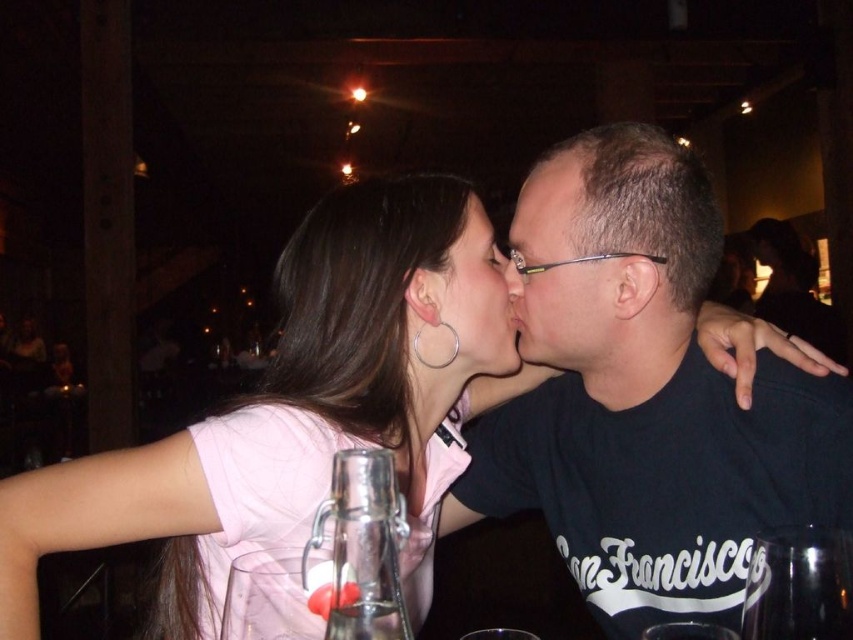
You are a photographer at the event and need to capture a clear photo of both the black matte shirt at center and the transparent glass at center. Since the transparent glass might be hard to focus on, can you adjust your camera settings to ensure both objects are in focus? Please explain using their sizes.

The black matte shirt at center is bigger than the transparent glass at center. By using a smaller aperture setting, you can increase the depth of field, ensuring both the larger black matte shirt and the smaller transparent glass are in focus simultaneously.

You are a photographer trying to capture the perfect shot of the matte black face at center and the matte black nose at center. Since you want to focus on the facial features, which object should you zoom in on to ensure it appears bigger in your photo?

The matte black face at center is larger in size than the matte black nose at center, so you should zoom in on the matte black face at center to make it appear bigger in the photo.

You are a photographer at the event and want to capture a clear shot of both the black matte shirt at center and the transparent glass at center. Which object will appear larger in the photo?

The black matte shirt at center will appear larger in the photo because it is closer to the viewer than the transparent glass at center.